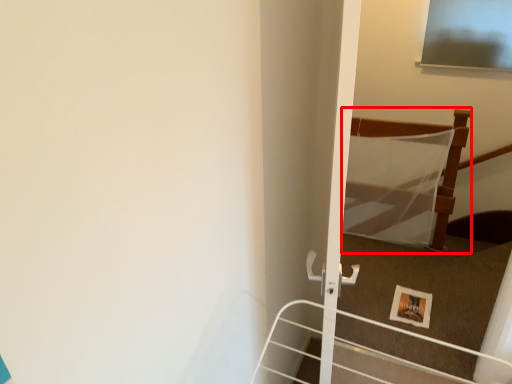
Question: From the image's perspective, what is the correct spatial positioning of bed (annotated by the red box) in reference to picture frame?

Choices:
 (A) above
 (B) below

Answer: (A)